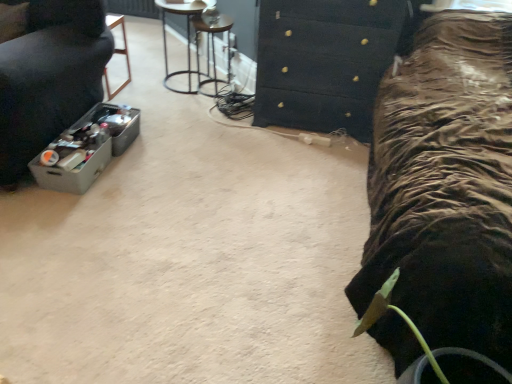
Question: In the image, is metallic wireframe stool at upper center on the left side or the right side of gray plastic container at left, placed as the 2th furniture when sorted from right to left?

Choices:
 (A) left
 (B) right

Answer: (B)

Question: Considering the positions of point (220, 96) and point (48, 117), is point (220, 96) closer or farther from the camera than point (48, 117)?

Choices:
 (A) closer
 (B) farther

Answer: (B)

Question: Which of these objects is positioned closest to the metallic wireframe stool at upper center?

Choices:
 (A) metallic wire side table at upper center, arranged as the 2th furniture when viewed from the left
 (B) black textured chest of drawers at upper center
 (C) gray plastic container at left, placed as the 2th furniture when sorted from right to left

Answer: (A)

Question: Estimate the real-world distances between objects in this image. Which object is closer to the metallic wireframe stool at upper center?

Choices:
 (A) black textured chest of drawers at upper center
 (B) metallic wire side table at upper center, the 1th furniture from the right
 (C) gray plastic container at left, which is the first furniture from left to right

Answer: (B)